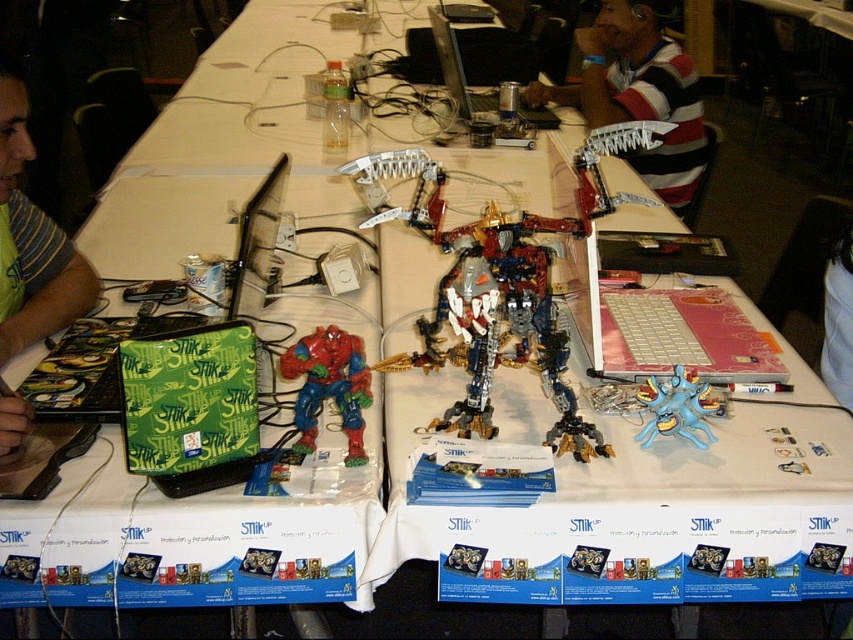
In the scene shown: Can you confirm if shiny plastic action figure at center is wider than blue rubber toy at center?

Indeed, shiny plastic action figure at center has a greater width compared to blue rubber toy at center.

Is point (317, 376) behind point (664, 401)?

No.

The width and height of the screenshot is (853, 640). In order to click on shiny plastic action figure at center in this screenshot , I will do `click(329, 387)`.

Can you confirm if striped shirt at upper right is bigger than shiny plastic action figure at center?

Indeed, striped shirt at upper right has a larger size compared to shiny plastic action figure at center.

Describe the element at coordinates (637, 92) in the screenshot. I see `striped shirt at upper right` at that location.

Find the location of a particular element. This screenshot has height=640, width=853. striped shirt at upper right is located at coordinates [x=637, y=92].

Between green matte laptop at left and blue rubber toy at center, which one appears on the left side from the viewer's perspective?

Positioned to the left is green matte laptop at left.

From the picture: Is green matte laptop at left in front of blue rubber toy at center?

That is False.

Does point (48, 232) come behind point (682, 424)?

Yes, point (48, 232) is behind point (682, 424).

The height and width of the screenshot is (640, 853). I want to click on green matte laptop at left, so click(32, 244).